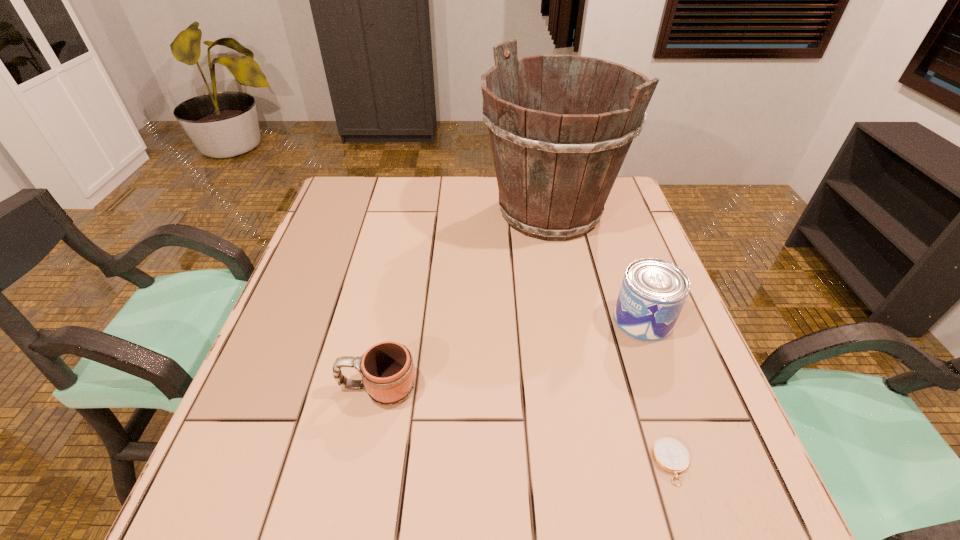
Where is `compass that is at the right edge`? compass that is at the right edge is located at coordinates (669, 454).

In order to click on object at the far right corner in this screenshot , I will do `click(555, 171)`.

You are a GUI agent. You are given a task and a screenshot of the screen. Output one action in this format:
    pyautogui.click(x=<x>, y=<y>)
    Task: Click on the object that is at the near right corner
    This screenshot has width=960, height=540.
    Given the screenshot: What is the action you would take?
    pyautogui.click(x=669, y=454)

In the image, there is a desktop. Identify the location of vacant space at the far edge. (482, 184).

Find the location of a particular element. Image resolution: width=960 pixels, height=540 pixels. vacant space at the left edge of the desktop is located at coordinates (322, 246).

The width and height of the screenshot is (960, 540). In the image, there is a desktop. In order to click on free space at the right edge in this screenshot , I will do `click(636, 241)`.

I want to click on free space at the far left corner of the desktop, so click(x=373, y=184).

Where is `free spot at the near right corner of the desktop`? This screenshot has height=540, width=960. free spot at the near right corner of the desktop is located at coordinates (740, 483).

Find the location of `free space between the nearest object and the tallest object`. free space between the nearest object and the tallest object is located at coordinates (611, 337).

Find the location of `free space between the leftmost object and the shortest object`. free space between the leftmost object and the shortest object is located at coordinates (524, 425).